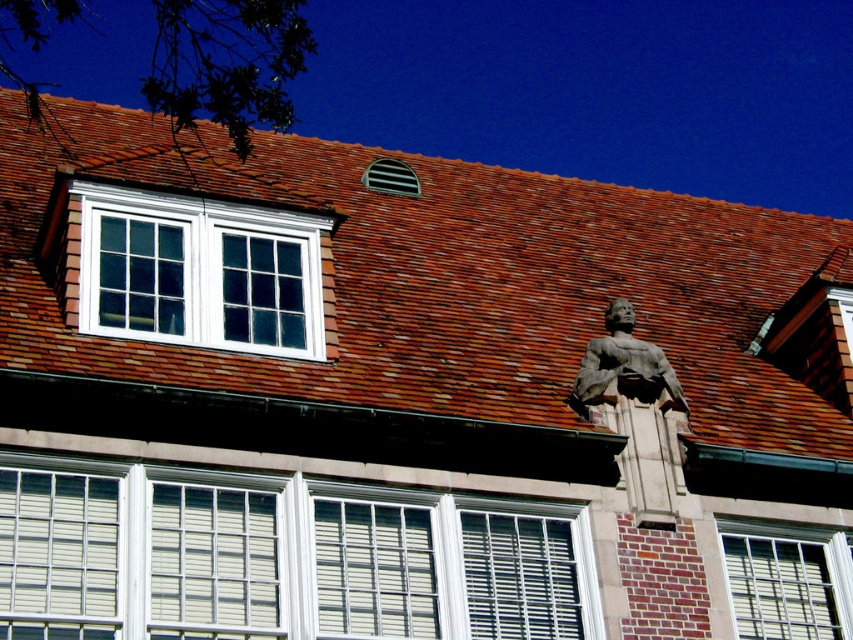
Question: Among these points, which one is farthest from the camera?

Choices:
 (A) (805, 573)
 (B) (575, 588)

Answer: (A)

Question: Where is white painted wood window at center located in relation to white textured shutters at center in the image?

Choices:
 (A) right
 (B) left

Answer: (B)

Question: Which point appears farthest from the camera in this image?

Choices:
 (A) (688, 212)
 (B) (393, 545)
 (C) (235, 632)

Answer: (A)

Question: Estimate the real-world distances between objects in this image. Which object is closer to the white textured shutters at center?

Choices:
 (A) white textured window at lower center
 (B) stone statue at upper right
 (C) brown tile roof at upper center

Answer: (B)

Question: Is brown tile roof at upper center bigger than white textured window at lower center?

Choices:
 (A) no
 (B) yes

Answer: (B)

Question: Is brown tile roof at upper center smaller than white textured window at lower center?

Choices:
 (A) yes
 (B) no

Answer: (B)